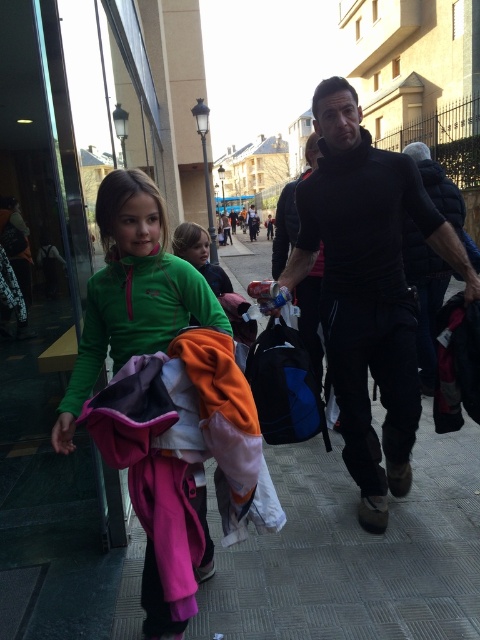
Does gray concrete pavement at center have a lesser height compared to black matte turtleneck at center?

In fact, gray concrete pavement at center may be taller than black matte turtleneck at center.

Where is `gray concrete pavement at center`? Image resolution: width=480 pixels, height=640 pixels. gray concrete pavement at center is located at coordinates (355, 552).

Where is `gray concrete pavement at center`? This screenshot has height=640, width=480. gray concrete pavement at center is located at coordinates (355, 552).

Who is positioned more to the left, black matte turtleneck at center or green fleece jacket at center?

green fleece jacket at center

Which is above, black matte turtleneck at center or green fleece jacket at center?

green fleece jacket at center is higher up.

Identify the location of black matte turtleneck at center. The image size is (480, 640). (368, 288).

How distant is black matte turtleneck at center from green fleece jacket at left?

black matte turtleneck at center is 1.03 meters away from green fleece jacket at left.

Who is positioned more to the left, black matte turtleneck at center or green fleece jacket at left?

green fleece jacket at left

Measure the distance between point (x=325, y=166) and camera.

A distance of 2.46 meters exists between point (x=325, y=166) and camera.

Find the location of `black matte turtleneck at center`. black matte turtleneck at center is located at coordinates (368, 288).